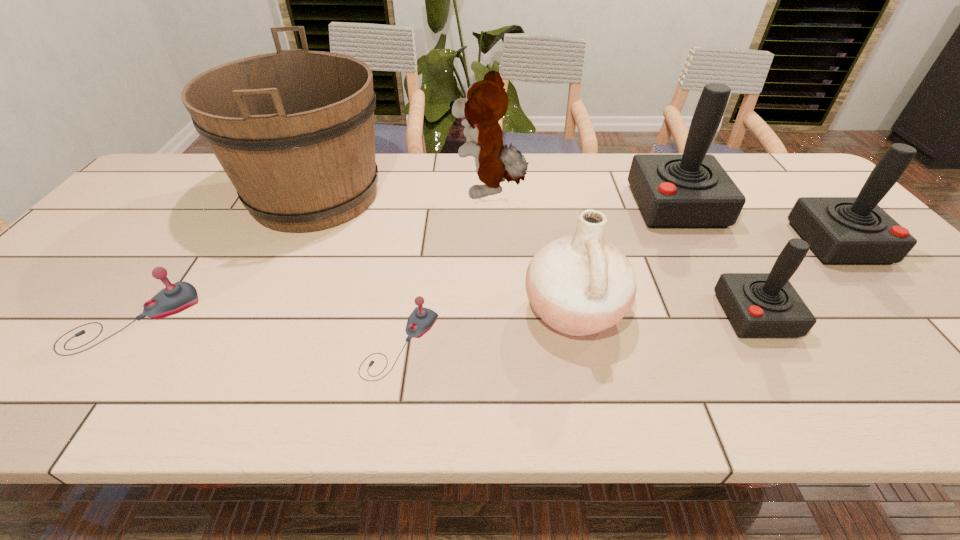
You are a GUI agent. You are given a task and a screenshot of the screen. Output one action in this format:
    pyautogui.click(x=<x>, y=<y>)
    Task: Click on the vacant region located to pour from the handle of the reddish-brown pottery
    The image size is (960, 540).
    Given the screenshot: What is the action you would take?
    pyautogui.click(x=408, y=310)

Locate an element on the screen. vacant space located 0.090m to pour from the handle of the reddish-brown pottery is located at coordinates click(483, 310).

I want to click on free spot located 0.050m to pour from the handle of the reddish-brown pottery, so click(x=500, y=310).

Identify the location of blank space located 0.200m on the base of the nearest red joystick. The width and height of the screenshot is (960, 540). (634, 315).

In order to click on free location located on the base of the nearest red joystick in this screenshot , I will do `click(642, 315)`.

Locate an element on the screen. This screenshot has width=960, height=540. vacant area located on the base of the nearest red joystick is located at coordinates (588, 315).

The height and width of the screenshot is (540, 960). Find the location of `free region located 0.330m on the right of the second shortest joystick`. free region located 0.330m on the right of the second shortest joystick is located at coordinates (340, 319).

What are the coordinates of `vacant area situated on the right of the second joystick from left to right` in the screenshot? It's located at (617, 344).

Find the location of a particular element. The width and height of the screenshot is (960, 540). bucket present at the far edge is located at coordinates (294, 131).

I want to click on joystick that is at the far edge, so click(691, 190).